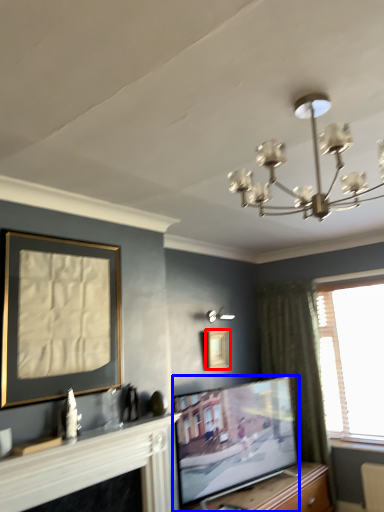
Question: Which point is further to the camera, picture frame (highlighted by a red box) or television (highlighted by a blue box)?

Choices:
 (A) picture frame
 (B) television

Answer: (A)